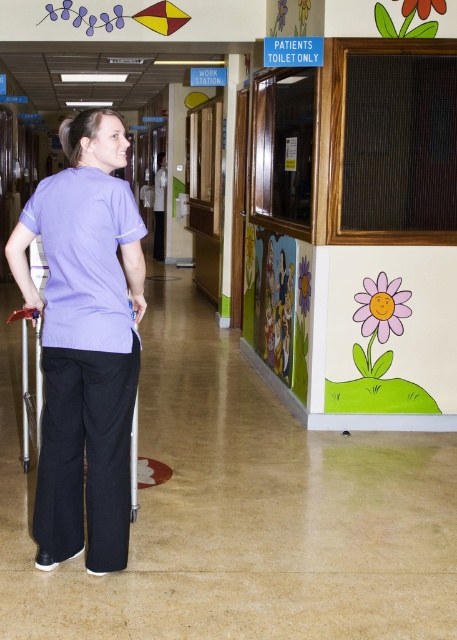
Question: Which point appears farthest from the camera in this image?

Choices:
 (A) (160, 202)
 (B) (116, 211)

Answer: (A)

Question: Which point is closer to the camera?

Choices:
 (A) (163, 172)
 (B) (76, 406)

Answer: (B)

Question: Among these points, which one is farthest from the camera?

Choices:
 (A) [x=97, y=257]
 (B) [x=154, y=218]

Answer: (B)

Question: Can you confirm if matte purple shirt at center is positioned below matte plastic walker at center?

Choices:
 (A) no
 (B) yes

Answer: (B)

Question: Does matte purple shirt at center appear over matte plastic walker at center?

Choices:
 (A) yes
 (B) no

Answer: (B)

Question: Is matte purple shirt at center thinner than matte plastic walker at center?

Choices:
 (A) yes
 (B) no

Answer: (B)